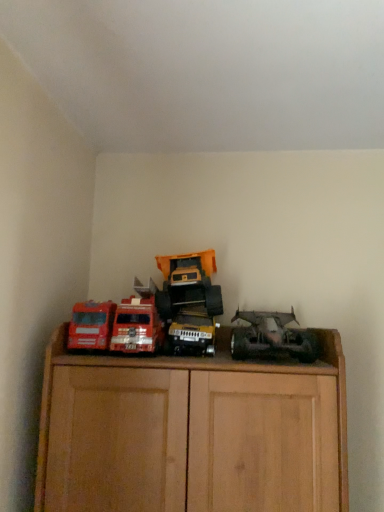
Question: Looking at their shapes, would you say metallic red fire truck at left, the third toy when ordered from right to left, is wider or thinner than matte red truck at left, the fourth toy viewed from the right?

Choices:
 (A) wide
 (B) thin

Answer: (A)

Question: From the image's perspective, is metallic red fire truck at left, the 2th toy viewed from the left, above or below matte red truck at left, the fourth toy viewed from the right?

Choices:
 (A) above
 (B) below

Answer: (A)

Question: Estimate the real-world distances between objects in this image. Which object is farther from the rusty metal truck at right, which appears as the 1th toy when viewed from the right?

Choices:
 (A) metallic red fire truck at left, the third toy when ordered from right to left
 (B) metallic yellow truck at center, the 3th toy in the left-to-right sequence
 (C) matte red truck at left, which is the 1th toy from left to right

Answer: (C)

Question: Which object is positioned farthest from the metallic yellow truck at center, the 3th toy in the left-to-right sequence?

Choices:
 (A) metallic red fire truck at left, the third toy when ordered from right to left
 (B) matte red truck at left, which is the 1th toy from left to right
 (C) rusty metal truck at right, acting as the fourth toy starting from the left

Answer: (B)